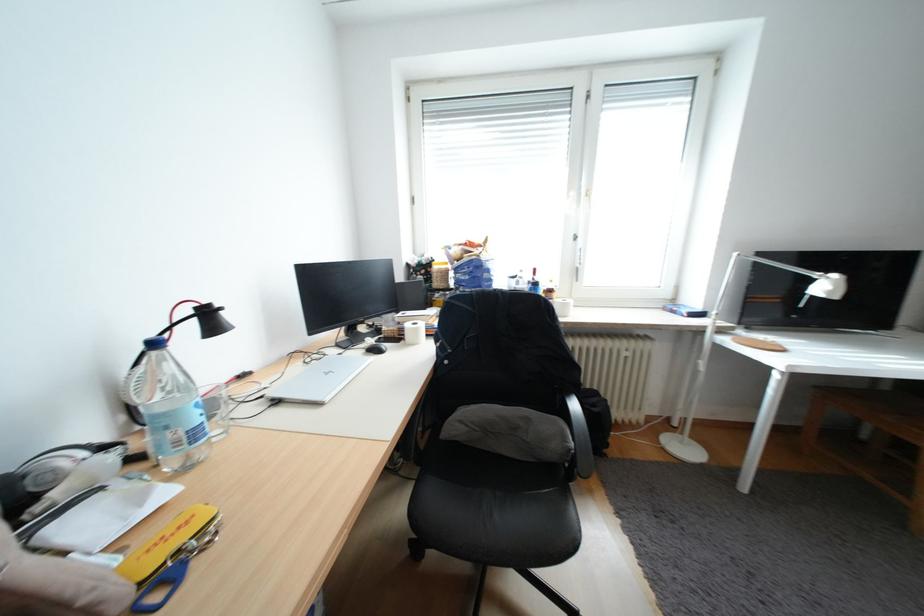
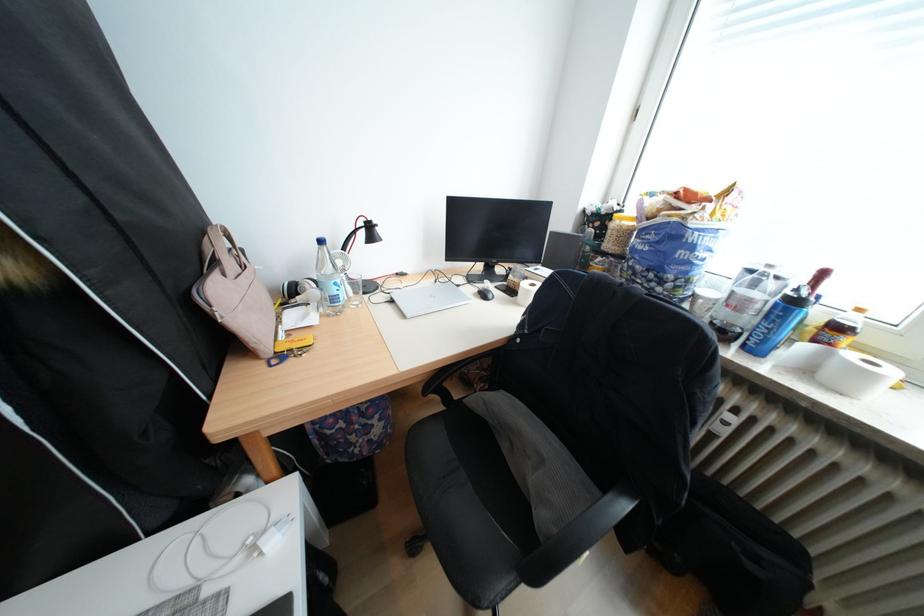
In the second image, find the point that corresponds to point 378,355 in the first image.

(487, 296)